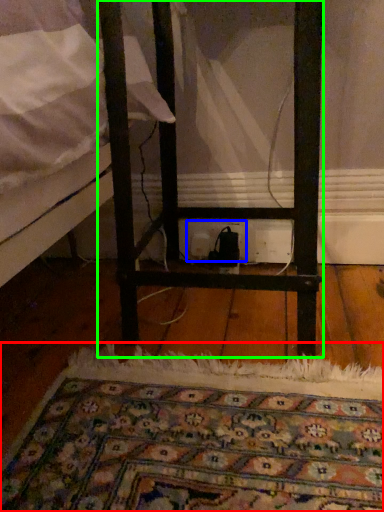
Question: Estimate the real-world distances between objects in this image. Which object is farther from mat (highlighted by a red box), electric outlet (highlighted by a blue box) or furniture (highlighted by a green box)?

Choices:
 (A) electric outlet
 (B) furniture

Answer: (A)